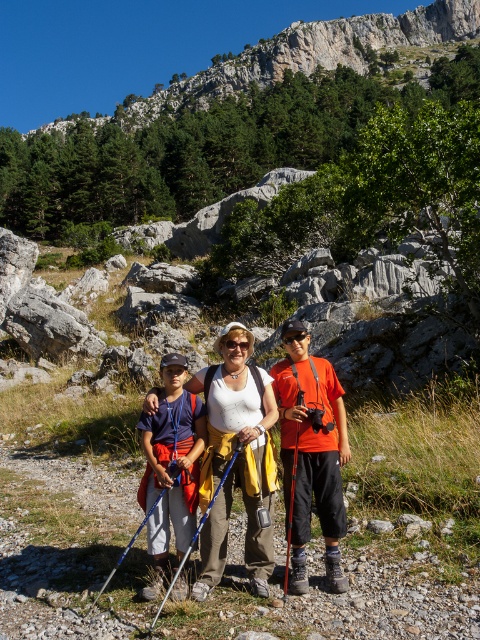
Question: In this image, where is rocky cliff at upper center located relative to blue fabric shirt at center?

Choices:
 (A) right
 (B) left

Answer: (B)

Question: Which object is the farthest from the orange matte shirt at center?

Choices:
 (A) rocky cliff at upper center
 (B) matte white tank top at center
 (C) blue fabric shirt at center

Answer: (A)

Question: Estimate the real-world distances between objects in this image. Which object is farther from the blue fabric shirt at center?

Choices:
 (A) orange matte shirt at center
 (B) rocky cliff at upper center
 (C) matte white tank top at center

Answer: (B)

Question: Does matte white tank top at center appear over blue fabric shirt at center?

Choices:
 (A) yes
 (B) no

Answer: (A)

Question: Which of the following is the closest to the observer?

Choices:
 (A) (301, 499)
 (B) (362, 20)
 (C) (145, 504)
 (D) (212, 552)

Answer: (D)

Question: Can you confirm if matte white tank top at center is positioned below blue fabric shirt at center?

Choices:
 (A) yes
 (B) no

Answer: (B)